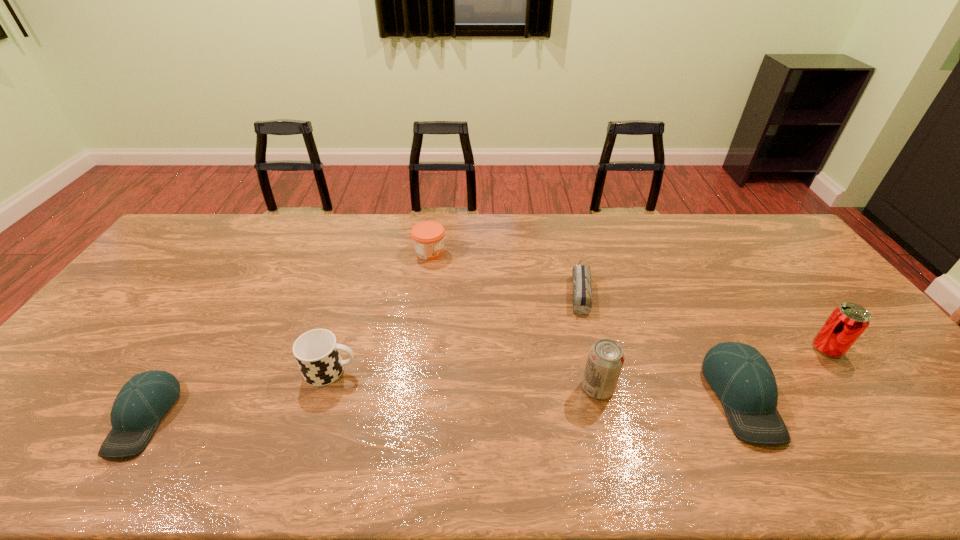
Identify the location of soda can located in the near edge section of the desktop. (605, 360).

What are the coordinates of `object at the right edge` in the screenshot? It's located at (847, 322).

The height and width of the screenshot is (540, 960). Identify the location of vacant space at the far edge of the desktop. (611, 234).

Image resolution: width=960 pixels, height=540 pixels. Identify the location of vacant space at the near edge of the desktop. (324, 398).

In the image, there is a desktop. Where is `vacant space at the left edge`? The width and height of the screenshot is (960, 540). vacant space at the left edge is located at coordinates tap(167, 268).

At what (x,y) coordinates should I click in order to perform the action: click on free space at the right edge of the desktop. Please return your answer as a coordinate pair (x, y). Image resolution: width=960 pixels, height=540 pixels. Looking at the image, I should click on (841, 368).

Find the location of a particular element. The image size is (960, 540). vacant region at the far left corner of the desktop is located at coordinates (204, 231).

This screenshot has height=540, width=960. What are the coordinates of `vacant region at the near right corner of the desktop` in the screenshot? It's located at pyautogui.click(x=903, y=408).

Identify the location of free area in between the right soda can and the taller baseball cap. (784, 373).

The width and height of the screenshot is (960, 540). I want to click on vacant area between the leftmost object and the nearer soda can, so click(x=371, y=402).